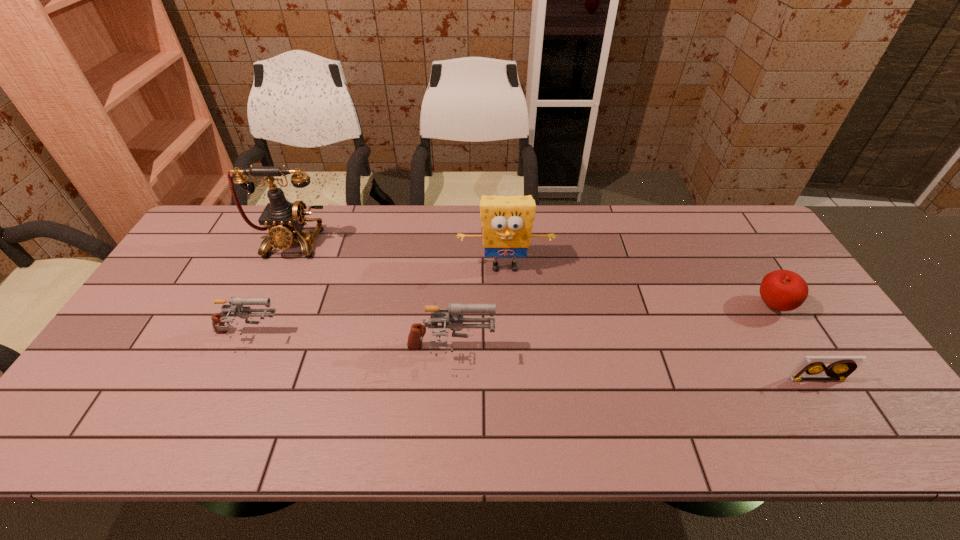
Given the evenly spaced guns in the image, where should an extra gun be added on the right to preserve the spacing? Please point to a vacant space. Please provide its 2D coordinates. Your answer should be formatted as a tuple, i.e. [(x, y)], where the tuple contains the x and y coordinates of a point satisfying the conditions above.

[(667, 369)]